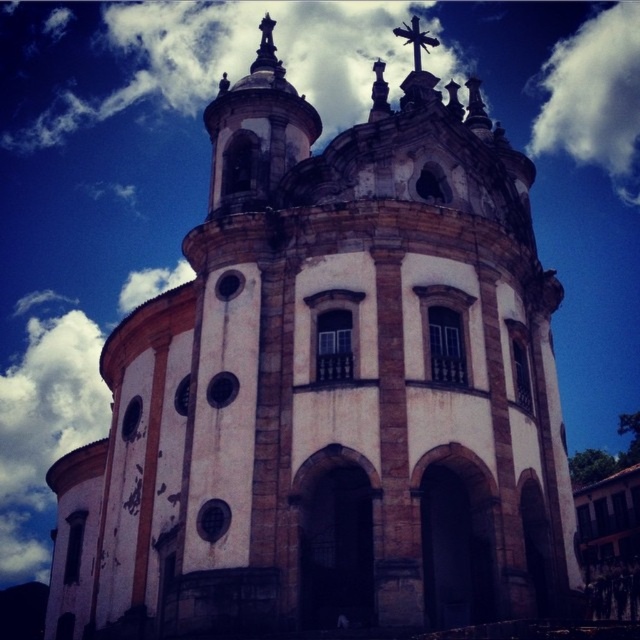
Is white fluffy cloud at upper right positioned at the back of metallic cross at upper center?

Yes, white fluffy cloud at upper right is behind metallic cross at upper center.

Does point (618, 116) lie behind point (419, 58)?

That is True.

The height and width of the screenshot is (640, 640). Identify the location of white fluffy cloud at upper right. (595, 97).